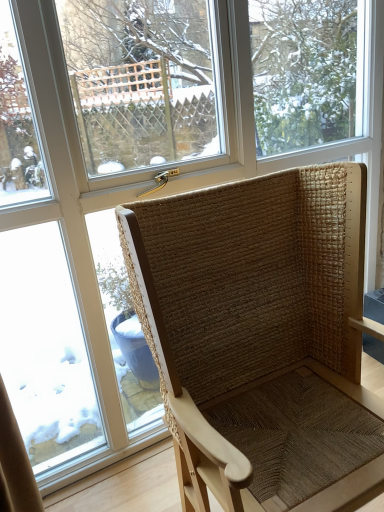
Describe the element at coordinates (261, 338) in the screenshot. I see `woven wood chair at center` at that location.

This screenshot has height=512, width=384. Identify the location of woven wood chair at center. (261, 338).

Identify the location of woven wood chair at center. This screenshot has width=384, height=512. (261, 338).